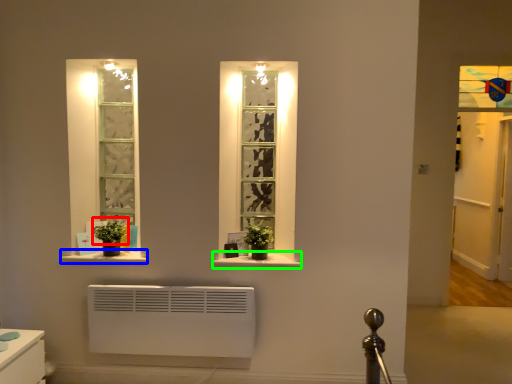
Question: Which object is positioned farthest from plant (highlighted by a red box)? Select from window sill (highlighted by a blue box) and window sill (highlighted by a green box).

Choices:
 (A) window sill
 (B) window sill

Answer: (B)